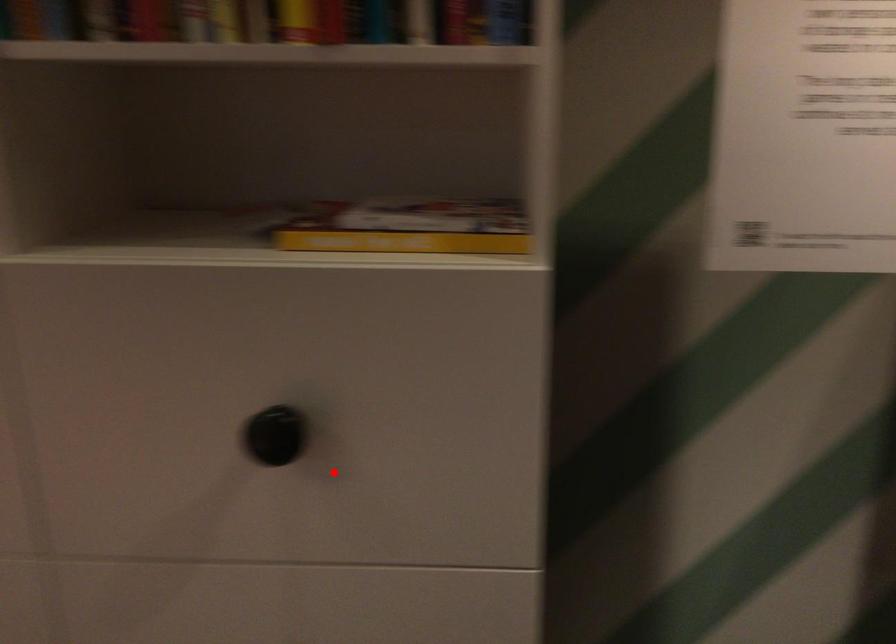
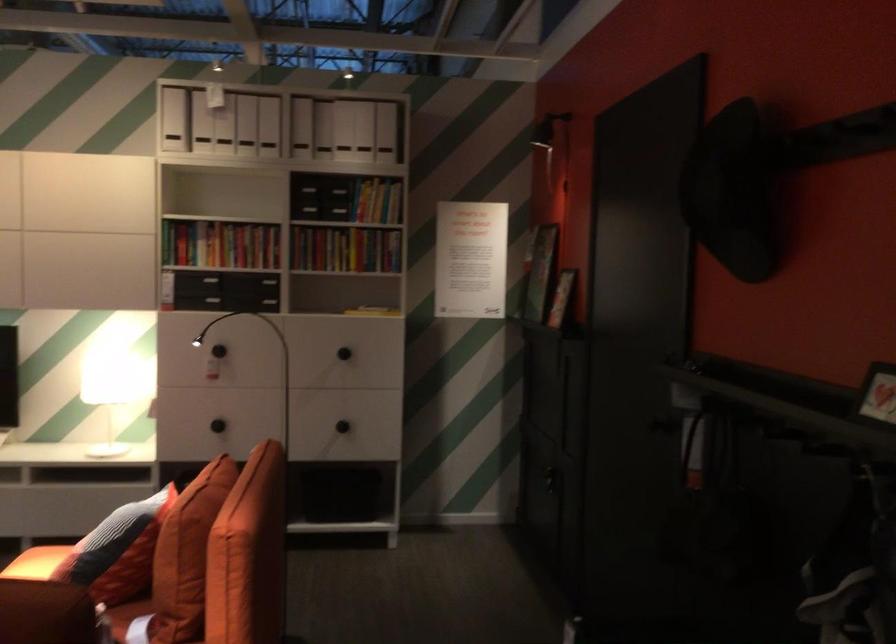
Question: I am providing you with two images of the same scene from different viewpoints. A red point is shown in image1. For the corresponding object point in image2, is it positioned nearer or farther from the camera?

Choices:
 (A) Nearer
 (B) Farther

Answer: (B)